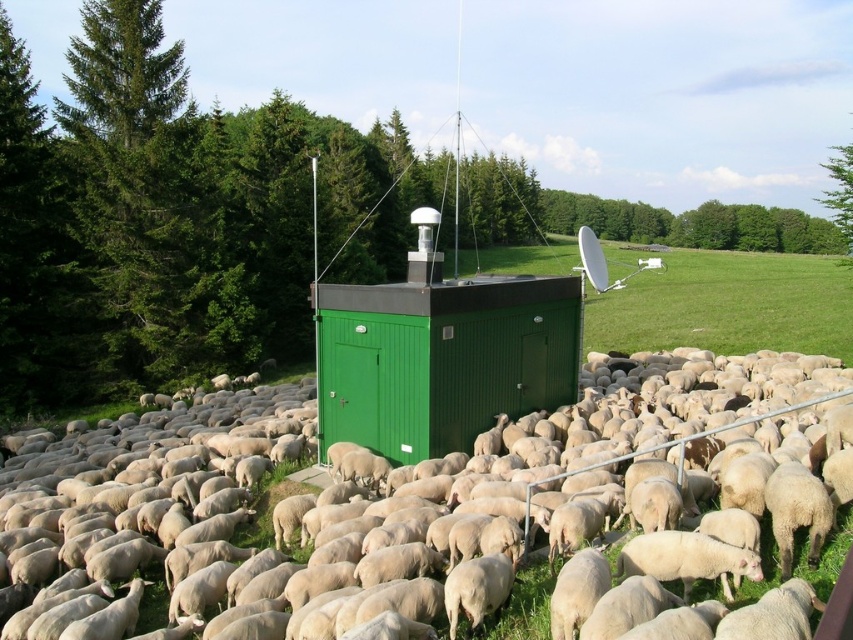
Can you confirm if white woolly sheep at center is shorter than green corrugated metal hut at center?

Yes, white woolly sheep at center is shorter than green corrugated metal hut at center.

Does white woolly sheep at center appear on the left side of green corrugated metal hut at center?

In fact, white woolly sheep at center is to the right of green corrugated metal hut at center.

Between point (12, 556) and point (524, 326), which one is positioned in front?

Positioned in front is point (12, 556).

The width and height of the screenshot is (853, 640). I want to click on white woolly sheep at center, so click(x=387, y=513).